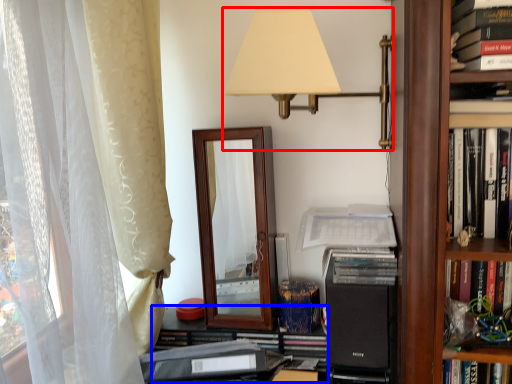
Question: Which object appears closest to the camera in this image, lamp (highlighted by a red box) or shelf (highlighted by a blue box)?

Choices:
 (A) lamp
 (B) shelf

Answer: (A)